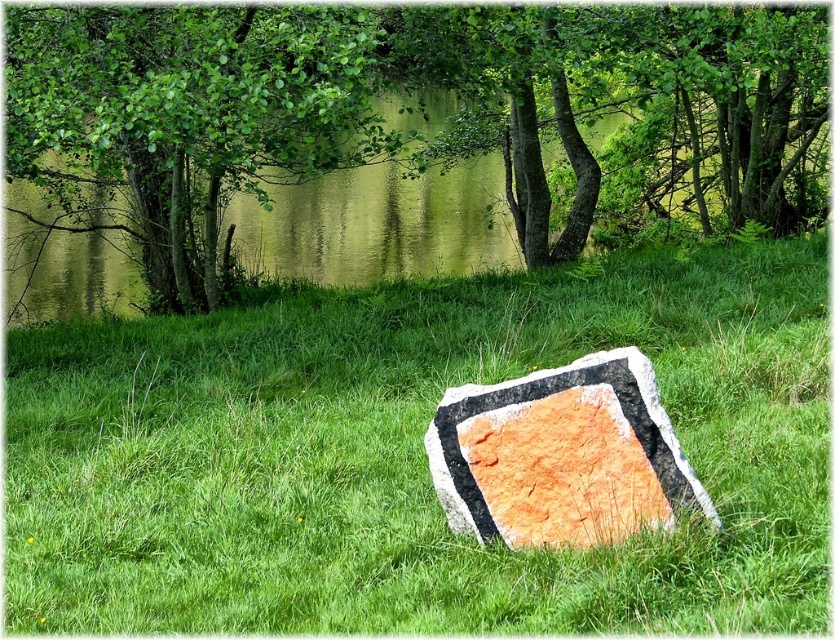
You are standing in the grassy area and want to walk to the orange textured stone at center. Which direction should you walk to avoid the green leafy tree at upper center?

To reach the orange textured stone at center while avoiding the green leafy tree at upper center, walk to the right side of the orange textured stone at center since the tree is on its left.

You are standing at the edge of the grassy area in the image and want to walk to the point marked by the coordinates point [397,112]. Is the path clear of any large obstacles between you and that point?

The path to point [397,112] is clear of large obstacles since the foreground and middle ground only have grass and a large stone, which is located away from the point.